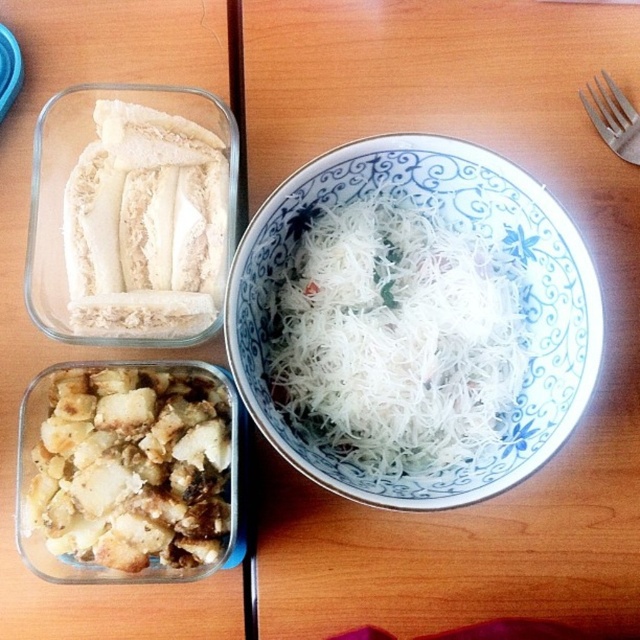
Question: Is brown crumbly bread at bottom left to the right of white fluffy bread at upper left from the viewer's perspective?

Choices:
 (A) no
 (B) yes

Answer: (A)

Question: Is white fluffy bread at upper left to the left of silver metallic fork at upper right from the viewer's perspective?

Choices:
 (A) yes
 (B) no

Answer: (A)

Question: Is brown crumbly bread at bottom left smaller than white fluffy bread at upper left?

Choices:
 (A) yes
 (B) no

Answer: (B)

Question: Which point is closer to the camera?

Choices:
 (A) white fluffy bread at upper left
 (B) white porcelain noodles at center
 (C) brown crumbly bread at bottom left

Answer: (B)

Question: Which point is farther to the camera?

Choices:
 (A) silver metallic fork at upper right
 (B) white fluffy bread at upper left
 (C) white porcelain noodles at center

Answer: (A)

Question: Which point appears closest to the camera in this image?

Choices:
 (A) (259, 230)
 (B) (161, 289)

Answer: (A)